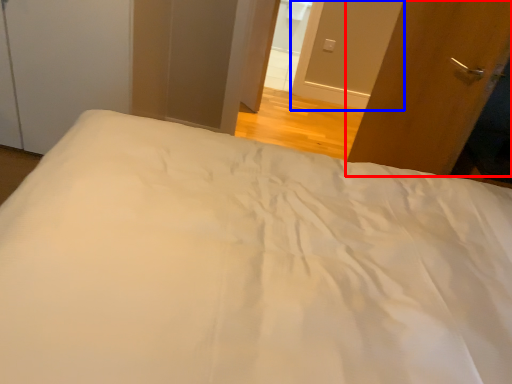
Question: Which object appears farthest to the camera in this image, door (highlighted by a red box) or screen door (highlighted by a blue box)?

Choices:
 (A) door
 (B) screen door

Answer: (B)